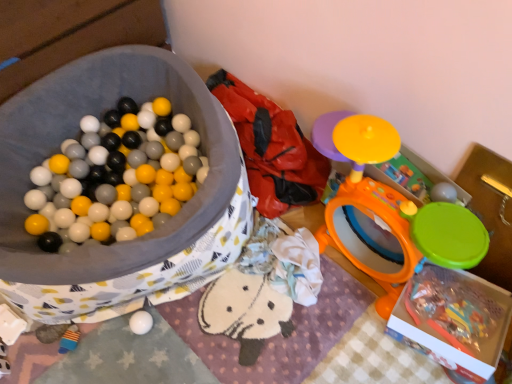
Question: From the image's perspective, does soft fabric bean bag at center appear lower than matte plastic ball pit at left, arranged as the first storage box when viewed from the left?

Choices:
 (A) no
 (B) yes

Answer: (A)

Question: Does soft fabric bean bag at center appear on the left side of matte plastic ball pit at left, arranged as the first storage box when viewed from the left?

Choices:
 (A) yes
 (B) no

Answer: (B)

Question: Can you confirm if soft fabric bean bag at center is taller than matte plastic ball pit at left, the second storage box viewed from the right?

Choices:
 (A) yes
 (B) no

Answer: (B)

Question: Does soft fabric bean bag at center have a lesser width compared to matte plastic ball pit at left, arranged as the first storage box when viewed from the left?

Choices:
 (A) no
 (B) yes

Answer: (B)

Question: Can you confirm if soft fabric bean bag at center is shorter than matte plastic ball pit at left, the second storage box viewed from the right?

Choices:
 (A) yes
 (B) no

Answer: (A)

Question: From their relative heights in the image, would you say white matte ball at lower center, marked as the third toy in a right-to-left arrangement, is taller or shorter than smooth plastic toy at lower left, the fourth toy in the right-to-left sequence?

Choices:
 (A) short
 (B) tall

Answer: (B)

Question: Is point (134, 316) closer or farther from the camera than point (66, 342)?

Choices:
 (A) farther
 (B) closer

Answer: (A)

Question: From a real-world perspective, is white matte ball at lower center, which is the second toy in bottom-to-top order, physically located above or below smooth plastic toy at lower left, arranged as the 4th toy when viewed from the top?

Choices:
 (A) above
 (B) below

Answer: (A)

Question: Considering their positions, is white matte ball at lower center, positioned as the 3th toy in top-to-bottom order, located in front of or behind smooth plastic toy at lower left, placed as the 1th toy when sorted from left to right?

Choices:
 (A) behind
 (B) front

Answer: (B)

Question: Relative to orange plastic drum at upper right, which is the 2th toy from top to bottom, is white matte ball at lower center, marked as the third toy in a right-to-left arrangement, in front or behind?

Choices:
 (A) behind
 (B) front

Answer: (A)

Question: In terms of width, does white matte ball at lower center, which ranks as the 2th toy in left-to-right order, look wider or thinner when compared to orange plastic drum at upper right, the 3th toy positioned from the left?

Choices:
 (A) wide
 (B) thin

Answer: (B)

Question: From the image's perspective, is white matte ball at lower center, marked as the third toy in a right-to-left arrangement, above or below orange plastic drum at upper right, positioned as the second toy in right-to-left order?

Choices:
 (A) above
 (B) below

Answer: (B)

Question: Is point (132, 319) positioned closer to the camera than point (340, 157)?

Choices:
 (A) farther
 (B) closer

Answer: (A)

Question: Considering their positions, is soft fabric bean bag at center located in front of or behind smooth plastic toy at lower left, arranged as the 4th toy when viewed from the top?

Choices:
 (A) behind
 (B) front

Answer: (B)

Question: In terms of size, does soft fabric bean bag at center appear bigger or smaller than smooth plastic toy at lower left, arranged as the 4th toy when viewed from the top?

Choices:
 (A) big
 (B) small

Answer: (A)